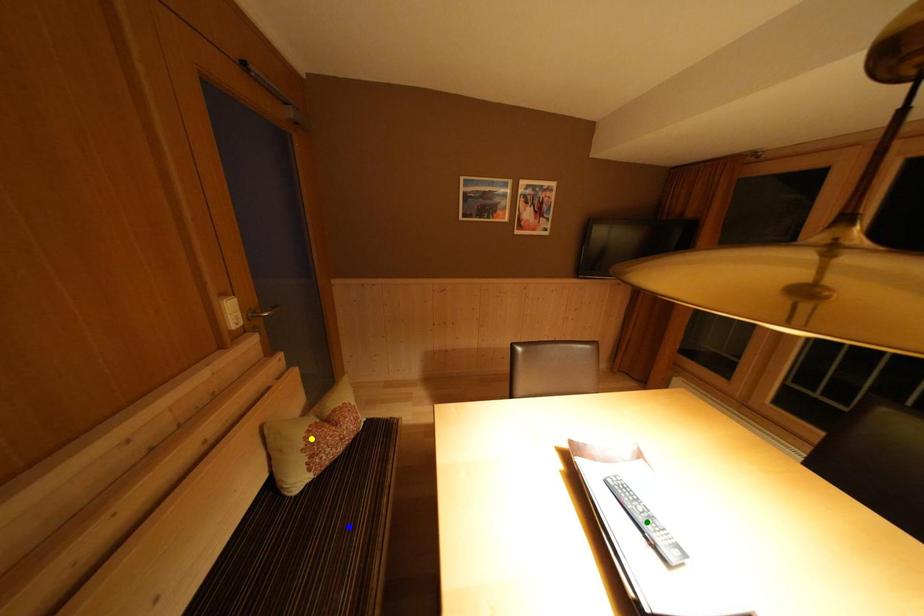
Order these from nearest to farthest:
yellow point
blue point
green point

green point, blue point, yellow point